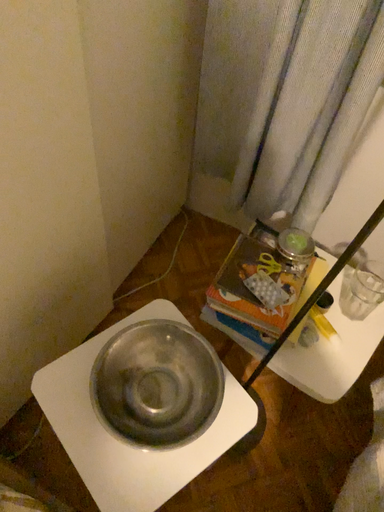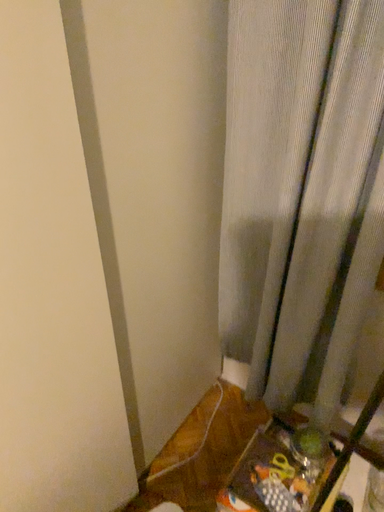
Question: Which way did the camera rotate in the video?

Choices:
 (A) rotated upward
 (B) rotated downward

Answer: (A)